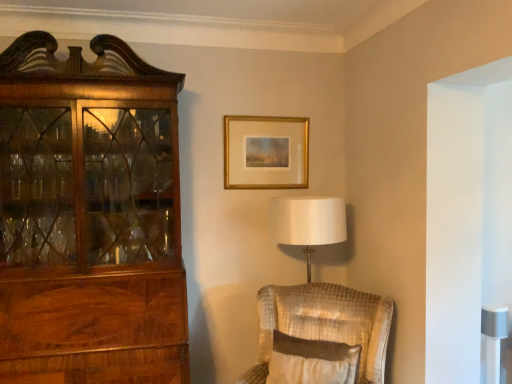
Question: Is velvet beige chair at lower right inside or outside of gold metallic picture frame at upper center?

Choices:
 (A) inside
 (B) outside

Answer: (B)

Question: From the image's perspective, relative to gold metallic picture frame at upper center, is velvet beige chair at lower right above or below?

Choices:
 (A) above
 (B) below

Answer: (B)

Question: Estimate the real-world distances between objects in this image. Which object is closer to the white textured pillow at center?

Choices:
 (A) velvet beige chair at lower right
 (B) gold metallic picture frame at upper center

Answer: (A)

Question: Which is farther from the gold metallic picture frame at upper center?

Choices:
 (A) white textured pillow at center
 (B) velvet beige chair at lower right

Answer: (A)